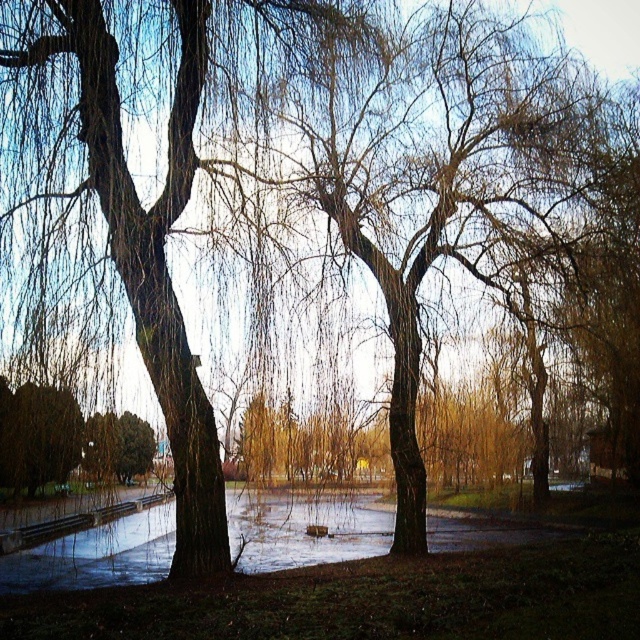
From the picture: You are planning to install a birdhouse on the tallest tree in the park. Based on the scene, which tree should you choose between the brown textured tree at left and the smooth bark tree at center?

The brown textured tree at left is taller than the smooth bark tree at center, so you should choose the brown textured tree at left to install the birdhouse.

You are planning to plant a new tree in the park. You want to ensure that the new tree will have enough space to grow without being overshadowed by the existing trees. Based on the scene, which tree, the brown textured tree at left or the smooth bark tree at center, is located closer to the ground where you might place the new tree?

The brown textured tree at left is positioned under the smooth bark tree at center, so the brown textured tree at left is closer to the ground. Therefore, the new tree should be planted farther from the brown textured tree at left to ensure enough space and sunlight.